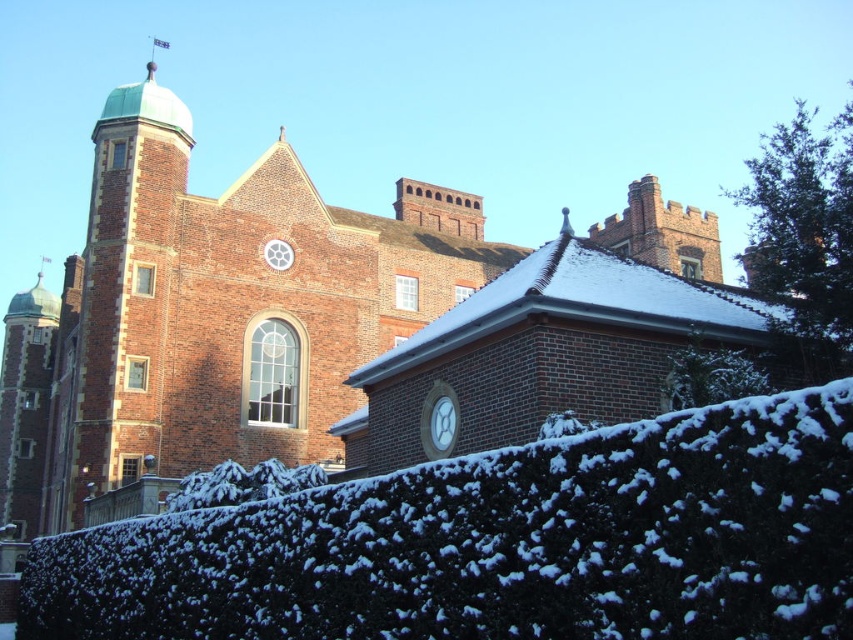
Question: Estimate the real-world distances between objects in this image. Which object is farther from the white snow-covered hedge at lower center?

Choices:
 (A) green leafy bush at upper right
 (B) green leafy bush at upper center

Answer: (A)

Question: Estimate the real-world distances between objects in this image. Which object is farther from the green leafy bush at upper right?

Choices:
 (A) white snow-covered hedge at lower center
 (B) green leafy bush at upper center
 (C) snow-covered hedge at lower center

Answer: (A)

Question: Is snow-covered hedge at lower center bigger than white snow-covered hedge at lower center?

Choices:
 (A) no
 (B) yes

Answer: (B)

Question: Among these points, which one is nearest to the camera?

Choices:
 (A) (769, 237)
 (B) (212, 484)
 (C) (666, 563)
 (D) (703, 352)

Answer: (C)

Question: Can you confirm if snow-covered hedge at lower center is smaller than white snow-covered hedge at lower center?

Choices:
 (A) no
 (B) yes

Answer: (A)

Question: Can you confirm if green leafy bush at upper center is wider than white snow-covered hedge at lower center?

Choices:
 (A) no
 (B) yes

Answer: (A)